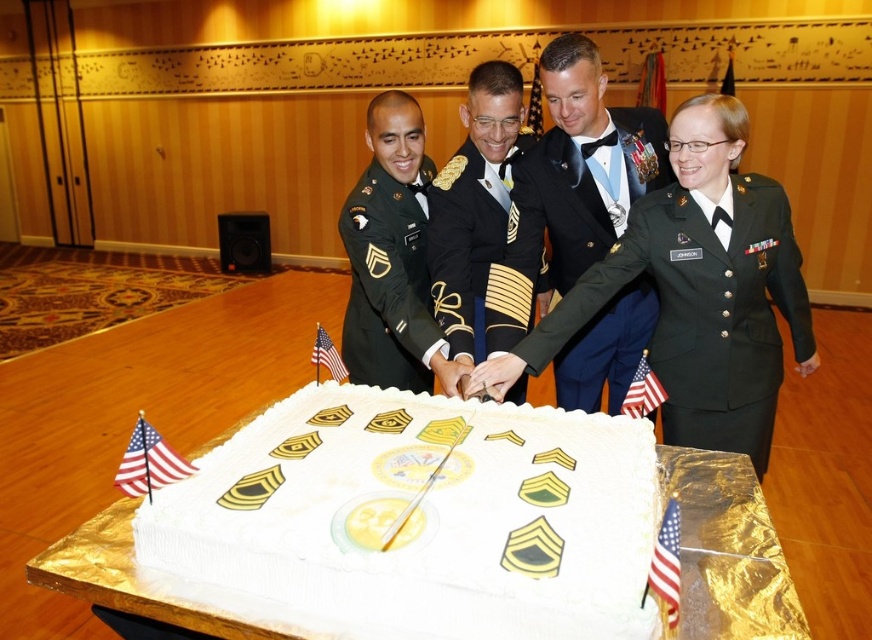
Question: Is green fabric uniform at center positioned behind green matte uniform at center?

Choices:
 (A) no
 (B) yes

Answer: (A)

Question: Which object is positioned closest to the american flag at center?

Choices:
 (A) white fabric flag at lower right
 (B) white fabric flag at lower left

Answer: (B)

Question: Which object is positioned farthest from the american flag at center?

Choices:
 (A) black satin uniform at center
 (B) green fabric uniform at center
 (C) white fabric flag at lower center
 (D) white fabric flag at lower right

Answer: (B)

Question: Can you confirm if white fabric flag at lower left is positioned to the left of white fabric flag at lower center?

Choices:
 (A) no
 (B) yes

Answer: (B)

Question: Considering the relative positions of white frosted cake at center and white fabric flag at lower right in the image provided, where is white frosted cake at center located with respect to white fabric flag at lower right?

Choices:
 (A) above
 (B) below

Answer: (A)

Question: Which object is positioned farthest from the american flag at center?

Choices:
 (A) green military uniform at center
 (B) white frosted cake at center
 (C) green matte uniform at center

Answer: (A)